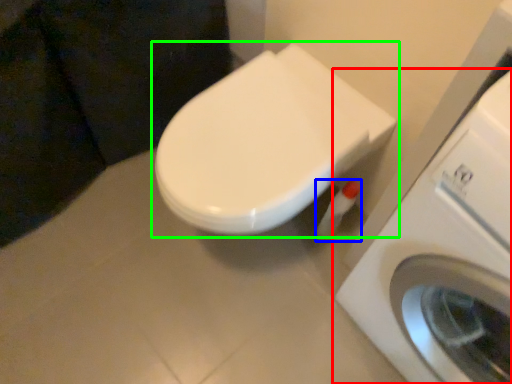
Question: Which is farther away from washing machine (highlighted by a red box)? toilet paper (highlighted by a blue box) or toilet (highlighted by a green box)?

Choices:
 (A) toilet paper
 (B) toilet

Answer: (A)